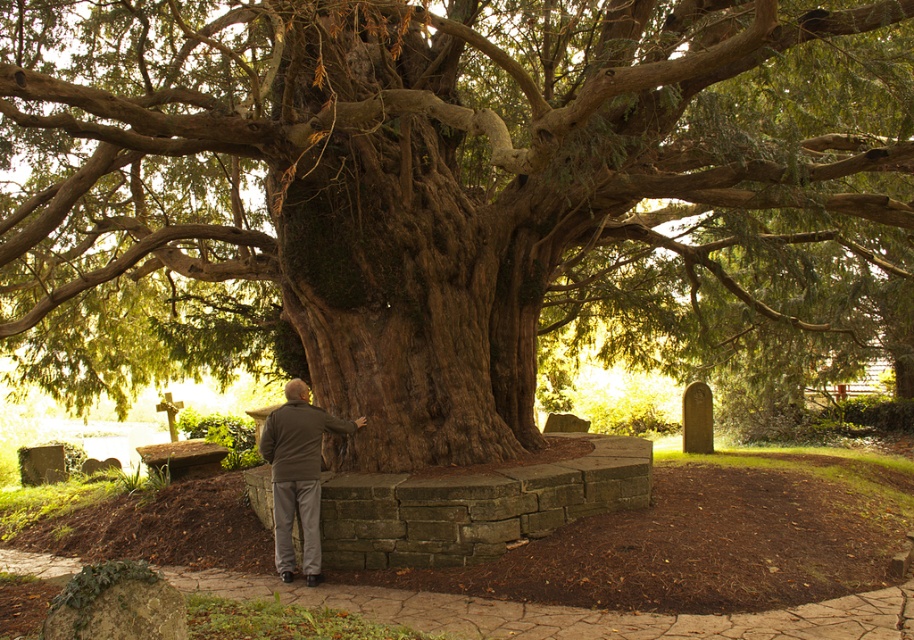
Can you confirm if dark brown textured bark at center is taller than dark gray jacket at center?

Yes, dark brown textured bark at center is taller than dark gray jacket at center.

Does dark brown textured bark at center appear on the left side of dark gray jacket at center?

In fact, dark brown textured bark at center is to the right of dark gray jacket at center.

Measure the distance between dark brown textured bark at center and camera.

dark brown textured bark at center and camera are 3.18 meters apart.

Identify the location of dark brown textured bark at center. Image resolution: width=914 pixels, height=640 pixels. (453, 198).